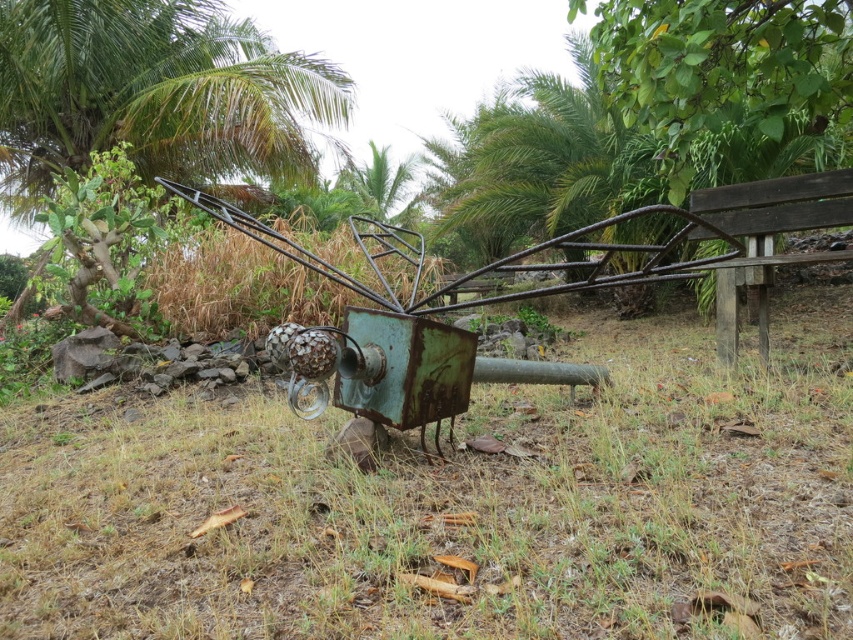
You are standing at the center of the outdoor scene and want to take a photo of the green leafy palm tree at upper left. In which direction should you point your camera to capture it?

The green leafy palm tree at upper left is located at point coordinates, so you should point your camera towards the upper left direction to capture it.

Based on the photo, you are standing in the outdoor scene with the rusted metal sculpture. You notice a point marked at coordinates (x=451, y=502). What is located at that point?

The point at coordinates (x=451, y=502) corresponds to green grass at center.